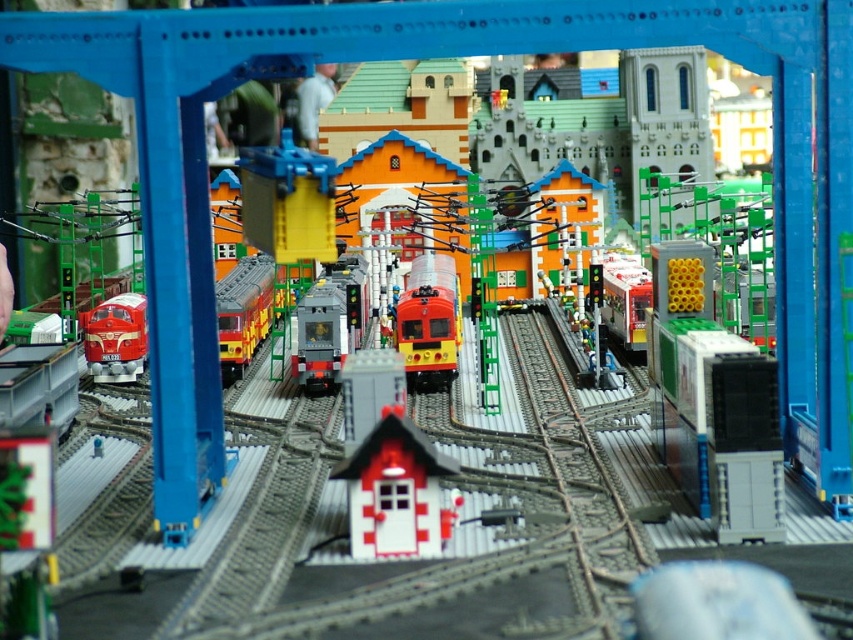
Describe the element at coordinates (397, 492) in the screenshot. Image resolution: width=853 pixels, height=640 pixels. I see `brick-patterned house at center` at that location.

Who is more forward, (403, 506) or (445, 296)?

Point (403, 506) is in front.

Is point (439, 513) closer to camera compared to point (424, 321)?

That is True.

In order to click on brick-patterned house at center in this screenshot , I will do point(397,492).

Between brick-patterned house at center and matte gray train at center, which one has more height?

matte gray train at center is taller.

Who is more forward, (422, 481) or (340, 362)?

Positioned in front is point (422, 481).

Is point (422, 508) behind point (322, 352)?

No, (422, 508) is in front of (322, 352).

This screenshot has width=853, height=640. I want to click on brick-patterned house at center, so click(x=397, y=492).

Is shiny red train at center taller than shiny red train at left?

Indeed, shiny red train at center has a greater height compared to shiny red train at left.

Which is behind, point (425, 323) or point (108, 380)?

The point (425, 323) is more distant.

Identify the location of shiny red train at center. (428, 317).